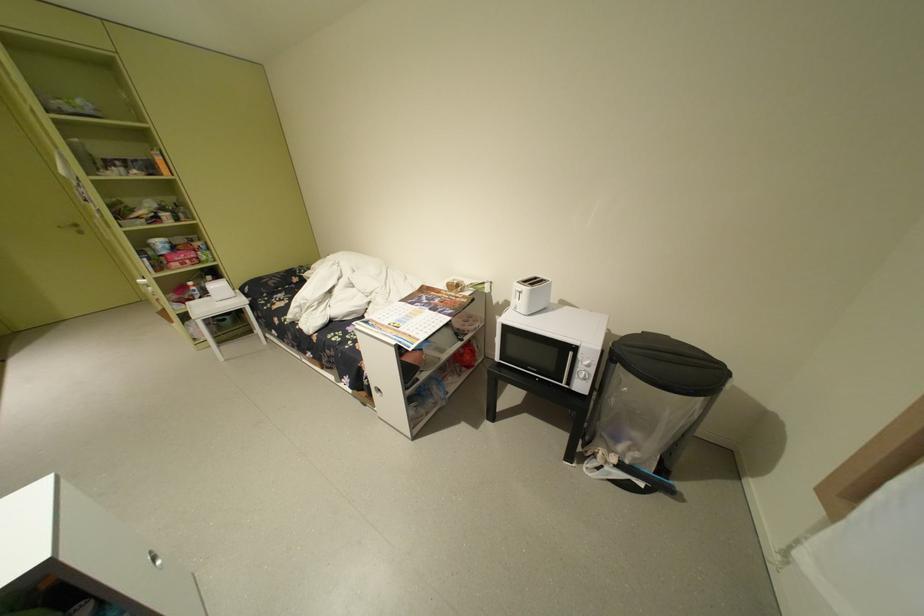
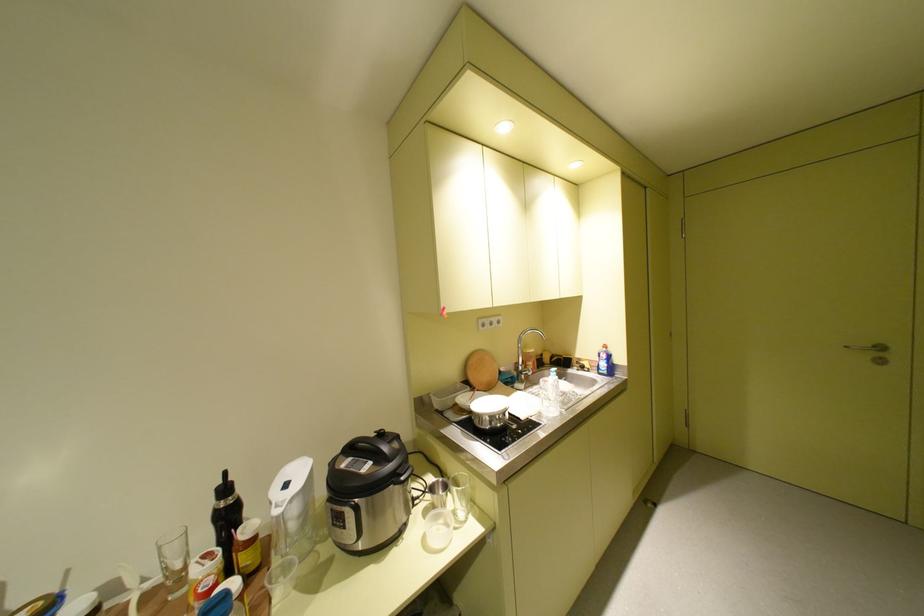
The point at (70, 228) is marked in the first image. Where is the corresponding point in the second image?

(857, 347)